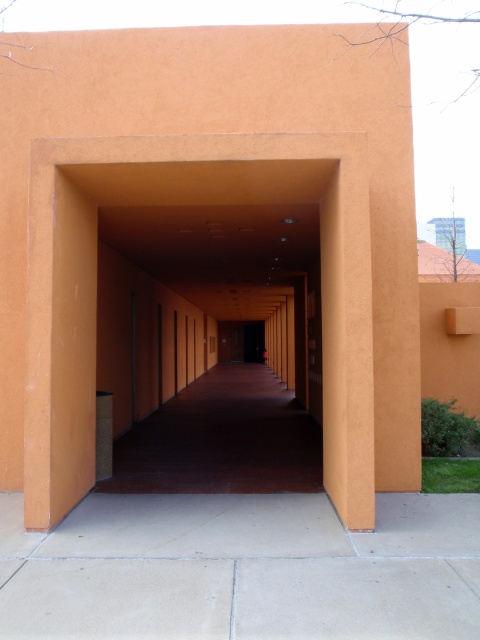
Question: Is smooth concrete pavement at center in front of smooth concrete corridor at center?

Choices:
 (A) yes
 (B) no

Answer: (A)

Question: Which object is positioned closest to the orange matte wall at center?

Choices:
 (A) smooth concrete pavement at center
 (B) smooth concrete corridor at center

Answer: (A)

Question: Is smooth concrete pavement at center below orange matte wall at center?

Choices:
 (A) yes
 (B) no

Answer: (A)

Question: Which of the following is the closest to the observer?

Choices:
 (A) smooth concrete pavement at center
 (B) smooth concrete corridor at center

Answer: (A)

Question: Is smooth concrete pavement at center smaller than smooth concrete corridor at center?

Choices:
 (A) yes
 (B) no

Answer: (A)

Question: Considering the real-world distances, which object is closest to the smooth concrete pavement at center?

Choices:
 (A) orange matte wall at center
 (B) smooth concrete corridor at center

Answer: (A)